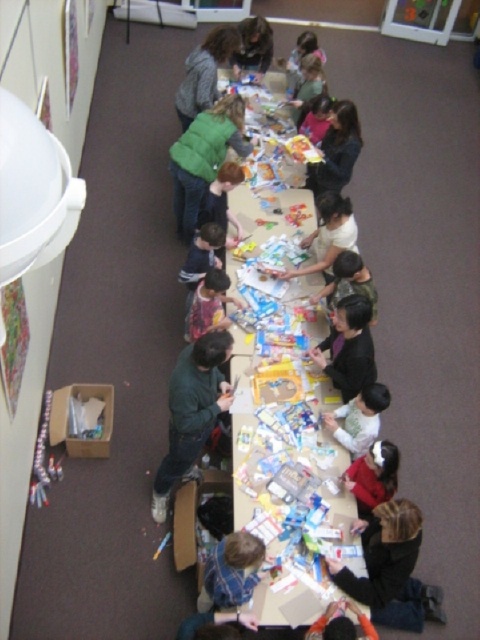
Question: Which object appears closest to the camera in this image?

Choices:
 (A) matte green sweater at upper center
 (B) white paper table at center

Answer: (B)

Question: Considering the relative positions of green fuzzy sweater at upper center and matte green sweater at upper center in the image provided, where is green fuzzy sweater at upper center located with respect to matte green sweater at upper center?

Choices:
 (A) above
 (B) below

Answer: (B)

Question: Observing the image, what is the correct spatial positioning of white paper table at center in reference to matte green sweater at upper center?

Choices:
 (A) below
 (B) above

Answer: (A)

Question: Does white paper table at center have a smaller size compared to green fuzzy sweater at center?

Choices:
 (A) no
 (B) yes

Answer: (A)

Question: Which object is the closest to the white matte shirt at lower center?

Choices:
 (A) green fuzzy sweater at upper center
 (B) green fuzzy sweater at center
 (C) matte green sweater at upper center
 (D) white paper table at center

Answer: (D)

Question: Which object is farther from the camera taking this photo?

Choices:
 (A) white matte shirt at lower center
 (B) green fuzzy sweater at upper center
 (C) plaid shirt at center

Answer: (B)